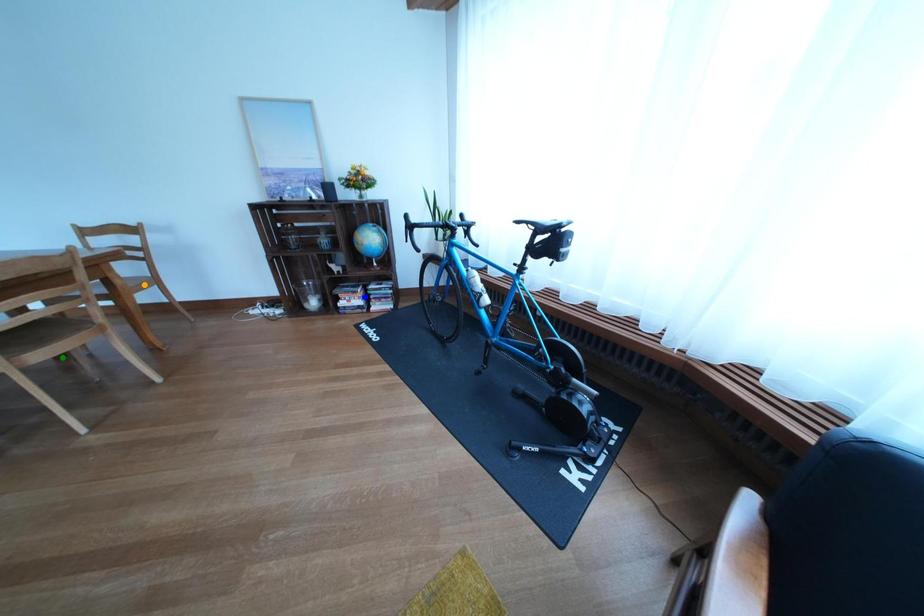
Order these from nearest to farthest:
1. green point
2. orange point
3. blue point

green point → orange point → blue point